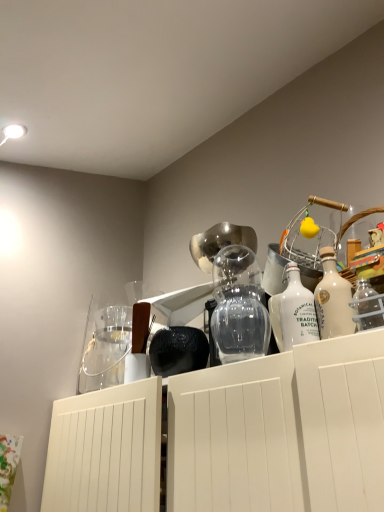
Question: Would you say white glass bottle at upper right, marked as the 2th bottle in a left-to-right arrangement, is to the left or to the right of clear glass jar at upper left in the picture?

Choices:
 (A) right
 (B) left

Answer: (A)

Question: From a real-world perspective, relative to clear glass jar at upper left, is white glass bottle at upper right, marked as the 2th bottle in a left-to-right arrangement, vertically above or below?

Choices:
 (A) above
 (B) below

Answer: (B)

Question: Estimate the real-world distances between objects in this image. Which object is farther from the white glass bottle at center, which ranks as the 2th bottle in right-to-left order?

Choices:
 (A) clear glass jar at upper left
 (B) transparent glass vase at center
 (C) white glass bottle at upper right, marked as the 2th bottle in a left-to-right arrangement

Answer: (A)

Question: Estimate the real-world distances between objects in this image. Which object is farther from the clear glass jar at upper left?

Choices:
 (A) white glass bottle at upper right, the 1th bottle from the right
 (B) white glass bottle at center, which ranks as the 2th bottle in right-to-left order
 (C) transparent glass vase at center

Answer: (A)